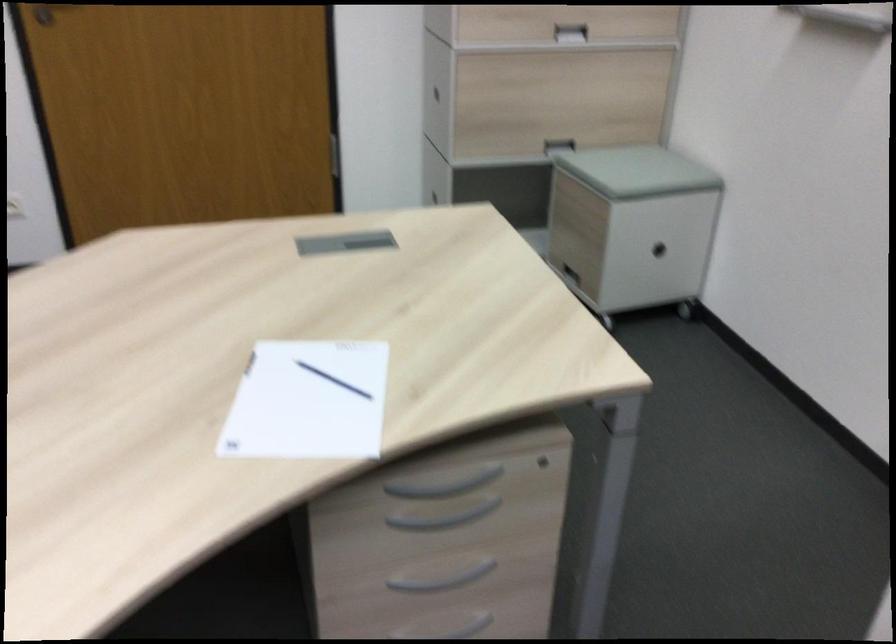
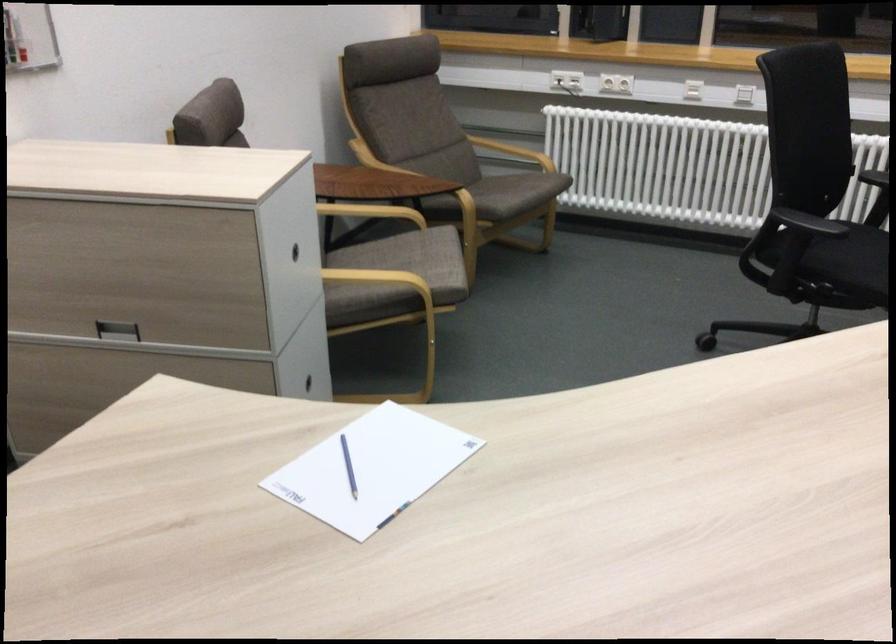
Question: I am providing you with two images of the same scene from different viewpoints. Please identify which objects are invisible in image2.

Choices:
 (A) green magnet
 (B) wooden chair armrest
 (C) grey drawer handle
 (D) recessed drawer handle

Answer: (C)